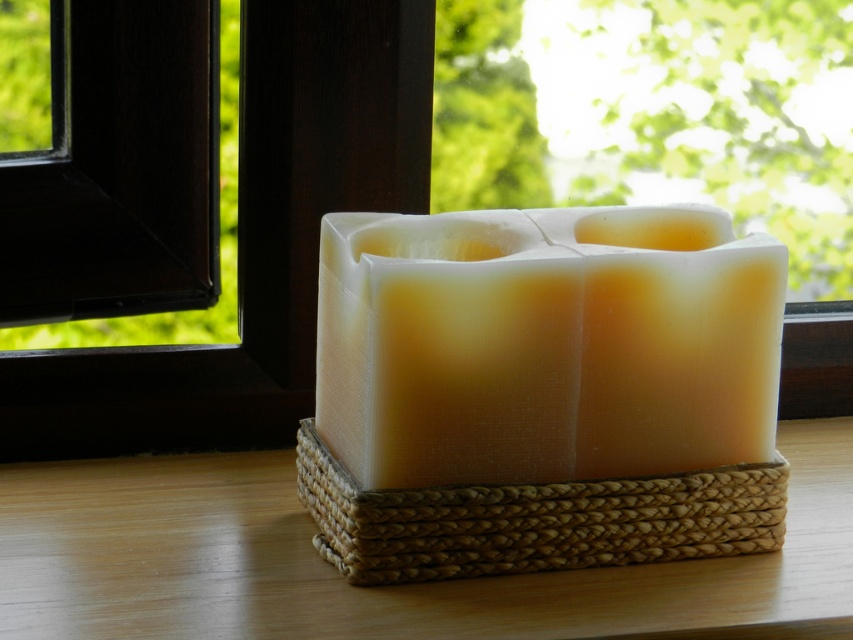
You are placing a small decorative item on a table and need to ensure it doesn not block the translucent wax candle at center. Where should you place the item to avoid covering the candle?

The translucent wax candle at center is located at point (544, 344). To avoid blocking it, place the item away from this coordinate.

You are standing in front of a basket with a rectangular block divided into four compartments. You need to place a translucent wax candle at center. According to the image, where exactly should you place it?

The translucent wax candle at center should be placed at the coordinates point (544, 344) as specified in the description.

You are standing in front of the basket with the divided block. If you look from your current position, which point, the point at coordinates [410,60] or the point at [819,509], is closer to you?

Point at [819,509] is closer to you since point at [410,60] is behind it according to their spatial arrangement.